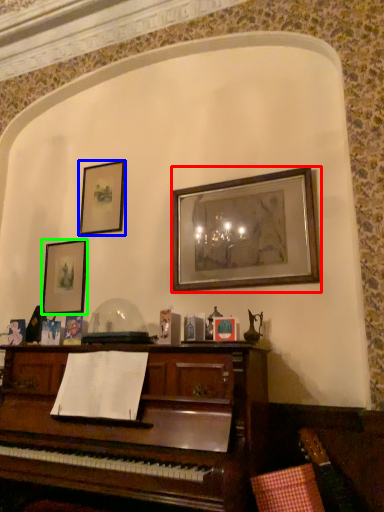
Question: Based on their relative distances, which object is nearer to picture frame (highlighted by a red box)? Choose from picture frame (highlighted by a blue box) and picture frame (highlighted by a green box).

Choices:
 (A) picture frame
 (B) picture frame

Answer: (A)